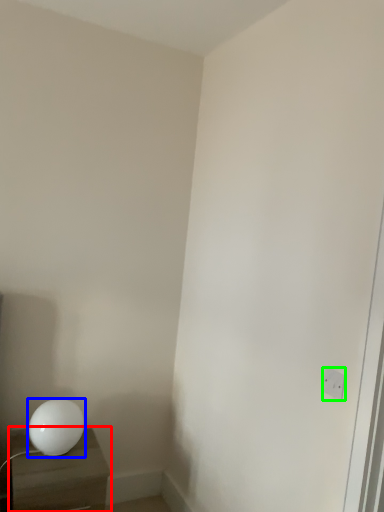
Question: Which is farther away from nightstand (highlighted by a red box)? lamp (highlighted by a blue box) or electric outlet (highlighted by a green box)?

Choices:
 (A) lamp
 (B) electric outlet

Answer: (B)